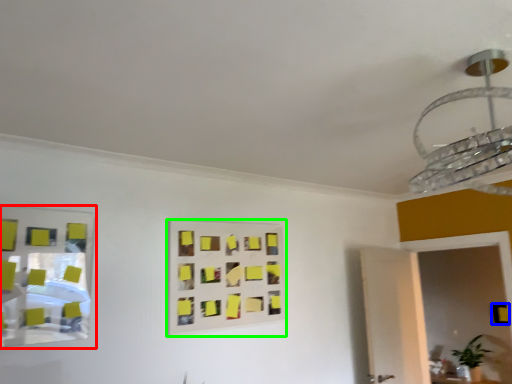
Question: Considering the real-world distances, which object is closest to mirror (highlighted by a red box)? square (highlighted by a blue box) or rectangle (highlighted by a green box).

Choices:
 (A) square
 (B) rectangle

Answer: (B)